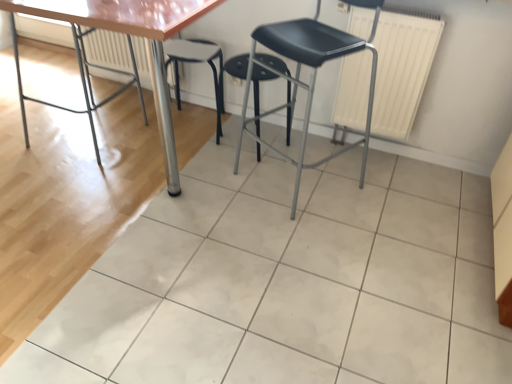
Question: Is matte black stool at center taller or shorter than white textured radiator at upper center, which is counted as the first radiator, starting from the back?

Choices:
 (A) short
 (B) tall

Answer: (B)

Question: Considering the positions of matte black stool at center and white textured radiator at upper center, the second radiator from the right, in the image, is matte black stool at center wider or thinner than white textured radiator at upper center, the second radiator from the right,?

Choices:
 (A) wide
 (B) thin

Answer: (A)

Question: Estimate the real-world distances between objects in this image. Which object is closer to the white matte radiator at upper right, which appears as the 1th radiator when viewed from the right?

Choices:
 (A) metallic polished table at left
 (B) black plastic stool at center, arranged as the 1th stool when viewed from the left
 (C) white glossy tile at center
 (D) matte black stool at center
 (E) black plastic stool at center, acting as the second stool starting from the left

Answer: (D)

Question: Estimate the real-world distances between objects in this image. Which object is farther from the black plastic stool at center, the second stool from the right?

Choices:
 (A) white matte radiator at upper right, the second radiator positioned from the back
 (B) matte black stool at center
 (C) white glossy tile at center
 (D) black plastic stool at center, the 1th stool viewed from the right
 (E) metallic polished table at left

Answer: (C)